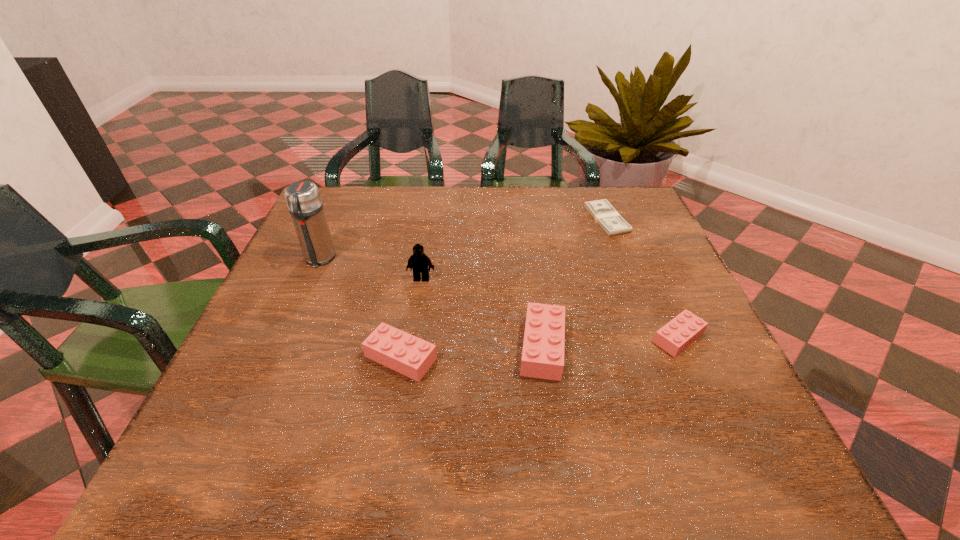
Find the location of a particular element. Image resolution: width=960 pixels, height=540 pixels. the third shortest object is located at coordinates pyautogui.click(x=402, y=352).

Locate an element on the screen. The width and height of the screenshot is (960, 540). the third Lego from left to right is located at coordinates (544, 339).

Where is `the third object from right to left`? The height and width of the screenshot is (540, 960). the third object from right to left is located at coordinates (544, 339).

Identify the location of the shortest Lego. This screenshot has width=960, height=540. (675, 336).

Locate an element on the screen. This screenshot has width=960, height=540. the rightmost Lego is located at coordinates (675, 336).

I want to click on dollar, so click(x=602, y=211).

Find the location of a particular element. the farthest object is located at coordinates (602, 211).

This screenshot has height=540, width=960. Identify the location of the leftmost object. (303, 198).

Identify the location of the tallest object. (303, 198).

The image size is (960, 540). Identify the location of the farthest Lego. [418, 262].